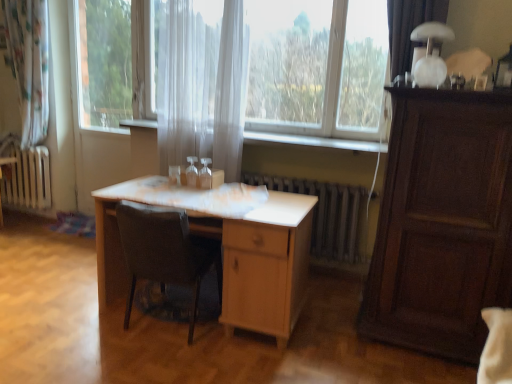
The width and height of the screenshot is (512, 384). Describe the element at coordinates (430, 55) in the screenshot. I see `white glossy table lamp at upper right` at that location.

What is the approximate height of transparent fabric at center?

transparent fabric at center is 1.05 meters tall.

Measure the distance between transparent fabric at center and camera.

11.16 feet.

Identify the location of transparent glass screen door at center. Image resolution: width=512 pixels, height=384 pixels. (100, 94).

The image size is (512, 384). What do you see at coordinates (329, 215) in the screenshot?
I see `white metallic radiator at center` at bounding box center [329, 215].

In order to click on translucent fabric curtain at center in this screenshot , I will do `click(202, 86)`.

Image resolution: width=512 pixels, height=384 pixels. I want to click on dark brown leather chair at center, so click(166, 252).

I want to click on white glossy table lamp at upper right, so click(x=430, y=55).

Based on the photo, how much distance is there between transparent fabric at center and dark wood cabinet at right?

The distance of transparent fabric at center from dark wood cabinet at right is 2.50 meters.

Considering the sizes of transparent fabric at center and dark wood cabinet at right in the image, is transparent fabric at center wider or thinner than dark wood cabinet at right?

Considering their sizes, transparent fabric at center looks slimmer than dark wood cabinet at right.

Is transparent fabric at center not close to dark wood cabinet at right?

That's right, there is a large distance between transparent fabric at center and dark wood cabinet at right.

Relative to dark wood cabinet at right, is transparent fabric at center in front or behind?

Clearly, transparent fabric at center is behind dark wood cabinet at right.

How far apart are transparent glass screen door at center and transparent fabric at center?

A distance of 4.80 inches exists between transparent glass screen door at center and transparent fabric at center.

Is transparent glass screen door at center taller than transparent fabric at center?

Yes.

From a real-world perspective, between transparent glass screen door at center and transparent fabric at center, who is vertically higher?

transparent fabric at center.

Which object is wider, transparent glass screen door at center or transparent fabric at center?

With larger width is transparent fabric at center.

Looking at this image, would you say dark brown leather chair at center is to the left or to the right of transparent fabric at center in the picture?

Based on their positions, dark brown leather chair at center is located to the left of transparent fabric at center.

Is dark brown leather chair at center shorter than transparent fabric at center?

Correct, dark brown leather chair at center is not as tall as transparent fabric at center.

I want to click on chair lying in front of the transparent fabric at center, so click(x=166, y=252).

Considering the points (169, 86) and (477, 184), which point is in front, point (169, 86) or point (477, 184)?

The point (477, 184) is more forward.

From their relative heights in the image, would you say translucent fabric curtain at center is taller or shorter than dark wood cabinet at right?

In the image, translucent fabric curtain at center appears to be taller than dark wood cabinet at right.

From a real-world perspective, is translucent fabric curtain at center on top of dark wood cabinet at right?

Yes, from a real-world perspective, translucent fabric curtain at center is above dark wood cabinet at right.

Is translucent fabric curtain at center aimed at dark wood cabinet at right?

No.

Is white sheer curtain at center completely or partially inside light wood table at center?

Result: No, white sheer curtain at center is not inside light wood table at center.

Considering the points (170, 203) and (267, 139), which point is behind, point (170, 203) or point (267, 139)?

The point (267, 139) is more distant.

Is light wood table at center turned away from white sheer curtain at center?

No, white sheer curtain at center is not at the back of light wood table at center.

Measure the distance between light wood table at center and white sheer curtain at center.

light wood table at center is 38.46 inches from white sheer curtain at center.

Can you see dark wood cabinet at right touching transparent fabric at center?

No, dark wood cabinet at right is not beside transparent fabric at center.

Which is in front, point (430, 139) or point (140, 85)?

The point (430, 139) is closer.

Who is shorter, dark wood cabinet at right or transparent fabric at center?

Standing shorter between the two is transparent fabric at center.

Where is `cabinetry below the transparent fabric at center (from a real-world perspective)`? The image size is (512, 384). cabinetry below the transparent fabric at center (from a real-world perspective) is located at coordinates (442, 222).

Is white sheer curtain at center positioned behind translucent fabric curtain at center?

Yes, white sheer curtain at center is further from the camera.

Considering the sizes of white sheer curtain at center and translucent fabric curtain at center in the image, is white sheer curtain at center taller or shorter than translucent fabric curtain at center?

In the image, white sheer curtain at center appears to be shorter than translucent fabric curtain at center.

Is white sheer curtain at center next to translucent fabric curtain at center?

white sheer curtain at center and translucent fabric curtain at center are not in contact.

Is white sheer curtain at center to the left of translucent fabric curtain at center from the viewer's perspective?

No.

Locate an element on the screen. cabinetry located on the right of transparent fabric at center is located at coordinates (442, 222).

The image size is (512, 384). I want to click on screen door to the left of transparent fabric at center, so click(x=100, y=94).

When comparing their distances from light wood table at center, does white metallic radiator at center or white sheer curtain at center seem further?

The object further to light wood table at center is white sheer curtain at center.

Which object lies further to the anchor point white sheer curtain at center, dark brown leather chair at center or light wood table at center?

dark brown leather chair at center is further to white sheer curtain at center.

Looking at the image, which one is located further to transparent fabric at center, transparent glass screen door at center or translucent fabric curtain at center?

The object further to transparent fabric at center is translucent fabric curtain at center.

From the image, which object appears to be nearer to dark brown leather chair at center, white metallic radiator at center or transparent fabric at center?

white metallic radiator at center.

Based on their spatial positions, is white sheer curtain at center or light wood table at center closer to transparent glass screen door at center?

white sheer curtain at center is positioned closer to the anchor transparent glass screen door at center.

When comparing their distances from translucent fabric curtain at center, does dark wood cabinet at right or light wood table at center seem further?

dark wood cabinet at right is further to translucent fabric curtain at center.

Which object lies further to the anchor point translucent fabric curtain at center, white glossy table lamp at upper right or white metallic radiator at center?

Among the two, white glossy table lamp at upper right is located further to translucent fabric curtain at center.

Which object lies further to the anchor point translucent fabric curtain at center, white sheer curtain at center or white glossy table lamp at upper right?

white glossy table lamp at upper right is further to translucent fabric curtain at center.

You are a GUI agent. You are given a task and a screenshot of the screen. Output one action in this format:
    pyautogui.click(x=<x>, y=<y>)
    Task: Click on the window located between transparent glass screen door at center and dark wood cabinet at right in the left-right direction
    
    Given the screenshot: What is the action you would take?
    pyautogui.click(x=117, y=63)

The width and height of the screenshot is (512, 384). Identify the location of table lamp situated between light wood table at center and dark wood cabinet at right from left to right. (430, 55).

Where is `window sill between translucent fabric curtain at center and white glossy table lamp at upper right from left to right`? The width and height of the screenshot is (512, 384). window sill between translucent fabric curtain at center and white glossy table lamp at upper right from left to right is located at coordinates (315, 141).

Find the location of a particular element. window sill between transparent fabric at center and light wood table at center in the vertical direction is located at coordinates (315, 141).